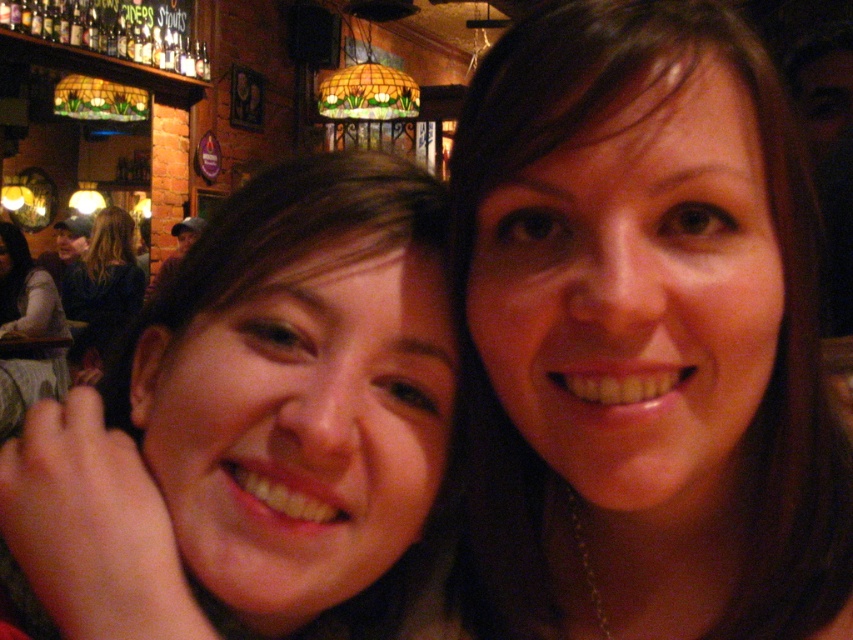
Question: Can you confirm if smooth skin face at center is positioned below dark brown hair at left?

Choices:
 (A) no
 (B) yes

Answer: (B)

Question: Which object appears farthest from the camera in this image?

Choices:
 (A) light brown hair at upper left
 (B) smooth skin face at center
 (C) brown hair at center
 (D) dark brown hair at left

Answer: (D)

Question: Considering the real-world distances, which object is closest to the brown hair at center?

Choices:
 (A) smooth skin face at center
 (B) dark brown hair at left

Answer: (A)

Question: Where is brown hair at center located in relation to smooth skin face at center in the image?

Choices:
 (A) below
 (B) above

Answer: (B)

Question: Which of the following is the closest to the observer?

Choices:
 (A) (257, 372)
 (B) (689, 307)

Answer: (B)

Question: Is the position of brown hair at center more distant than that of light brown hair at upper left?

Choices:
 (A) yes
 (B) no

Answer: (B)